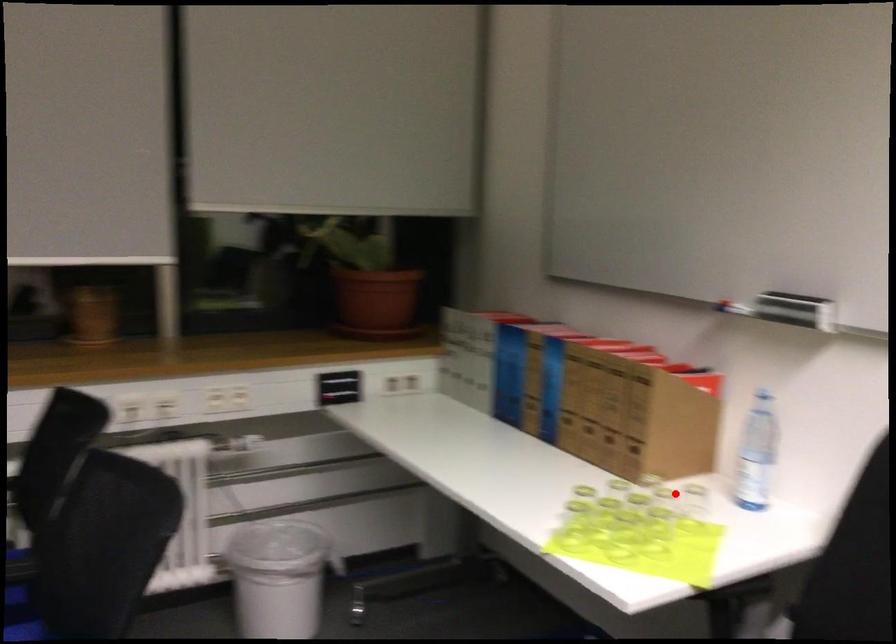
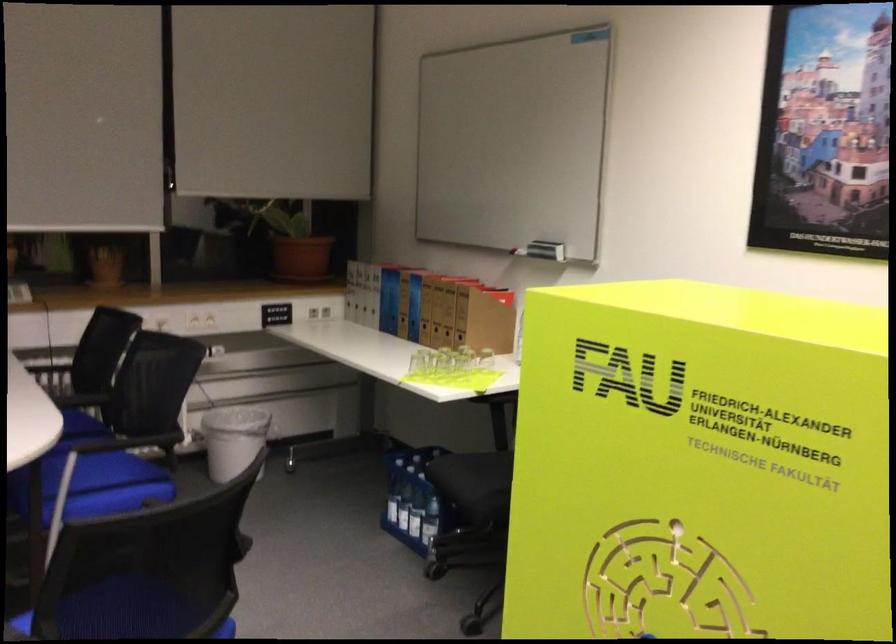
Question: I am providing you with two images of the same scene from different viewpoints. A red point is marked on the first image. At the location where the point appears in image 1, is it still visible in image 2?

Choices:
 (A) Yes
 (B) No

Answer: (A)